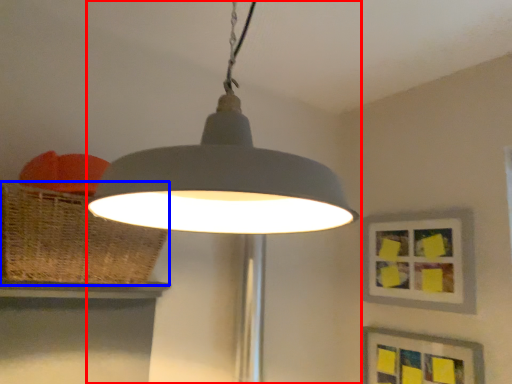
Question: Among these objects, which one is nearest to the camera, lamp (highlighted by a red box) or basket (highlighted by a blue box)?

Choices:
 (A) lamp
 (B) basket

Answer: (A)